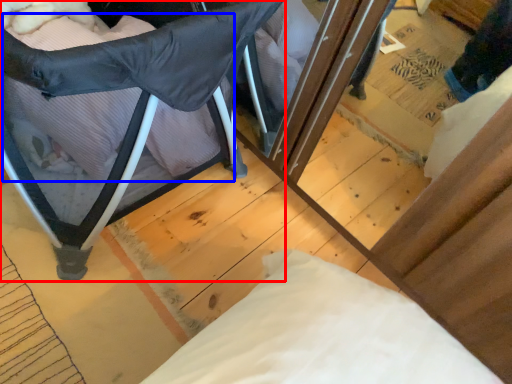
Question: Which of the following is the farthest to the observer, furniture (highlighted by a red box) or pillow (highlighted by a blue box)?

Choices:
 (A) furniture
 (B) pillow

Answer: (B)